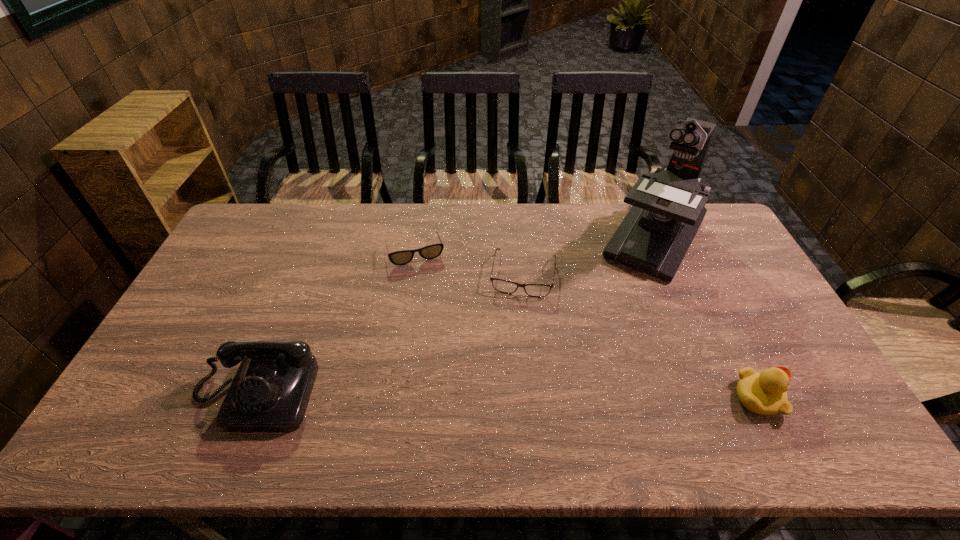
Find the location of a particular element. The width and height of the screenshot is (960, 540). vacant space in between the spectacles and the tallest object is located at coordinates (588, 257).

The image size is (960, 540). Identify the location of free space between the duckling and the tallest object. (706, 319).

Identify the location of vacant space in between the spectacles and the duckling. Image resolution: width=960 pixels, height=540 pixels. (640, 336).

I want to click on vacant space that's between the microscope and the third object from left to right, so click(x=588, y=257).

Image resolution: width=960 pixels, height=540 pixels. In order to click on free space between the second object from left to right and the duckling in this screenshot , I will do 587,325.

Identify the location of vacant area that lies between the third object from right to left and the telephone. (389, 335).

Where is `empty location between the spectacles and the microscope`? The image size is (960, 540). empty location between the spectacles and the microscope is located at coordinates (588, 257).

What are the coordinates of `free spot between the spectacles and the tallest object` in the screenshot? It's located at (588, 257).

The image size is (960, 540). I want to click on vacant space in between the spectacles and the duckling, so click(640, 336).

You are a GUI agent. You are given a task and a screenshot of the screen. Output one action in this format:
    pyautogui.click(x=<x>, y=<y>)
    Task: Click on the vacant area between the leftmost object and the sunglasses
    The width and height of the screenshot is (960, 540).
    Given the screenshot: What is the action you would take?
    pyautogui.click(x=335, y=323)